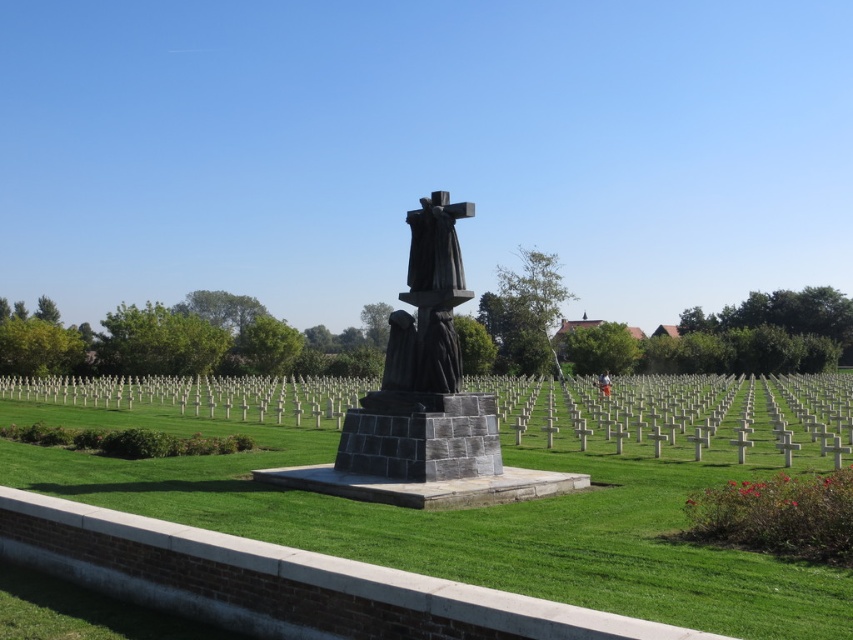
You are a visitor at the war memorial and want to place a small bouquet between the dark gray stone statue at center and the light brown wooden stick at center. Since you want the bouquet to be visible from all angles, which object should you place it closer to?

You should place the bouquet closer to the dark gray stone statue at center because it occupies less space than the light brown wooden stick at center, allowing more visibility around it.

You are a visitor at the war memorial and want to take a photo of the dark gray stone sculpture at center and the light brown wooden stick at center. Your camera can capture objects within a 25 meter range. Will both objects be in the same photo?

The dark gray stone sculpture at center is 26.64 meters from the light brown wooden stick at center, which is beyond the camera range of 25 meters. Therefore, both objects cannot be captured in the same photo.

You are standing at the camera position and want to place a 10 feet long flagpole exactly 35 feet away from you. Can you place it right where the dark gray stone sculpture at center is located?

The dark gray stone sculpture at center is 34.98 feet away from camera, so yes, you can place the 10 feet long flagpole there since it is almost exactly 35 feet away.